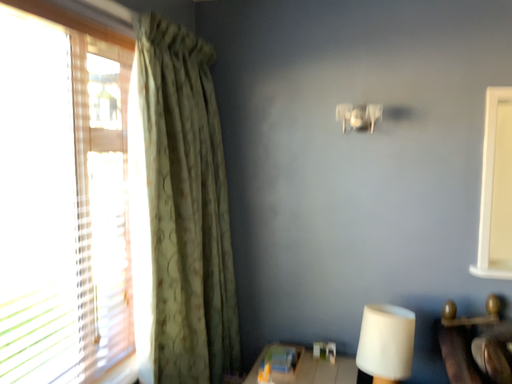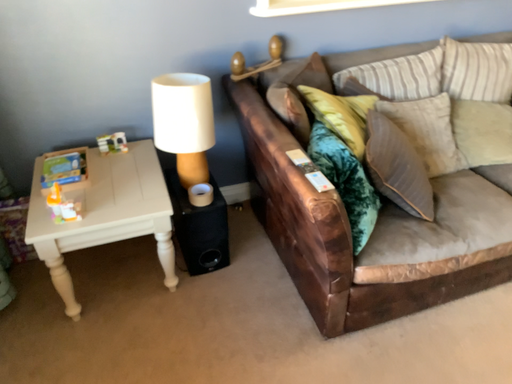
Question: How did the camera likely rotate when shooting the video?

Choices:
 (A) rotated right
 (B) rotated left

Answer: (A)